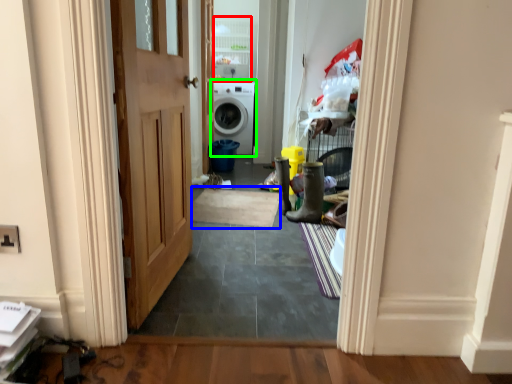
Question: Which object is the farthest from cabinetry (highlighted by a red box)? Choose among these: doormat (highlighted by a blue box) or washing machine (highlighted by a green box).

Choices:
 (A) doormat
 (B) washing machine

Answer: (A)